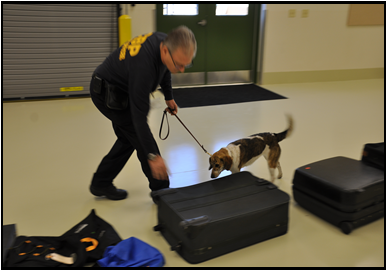
What are the coordinates of `outlets` in the screenshot? It's located at (303, 12).